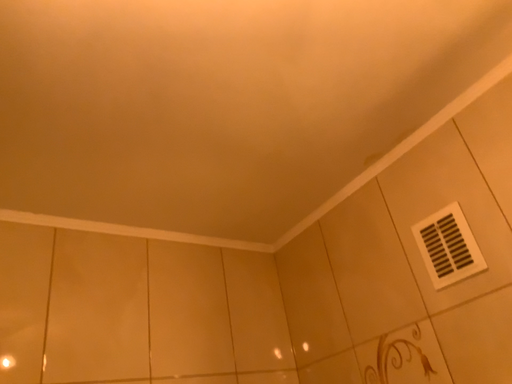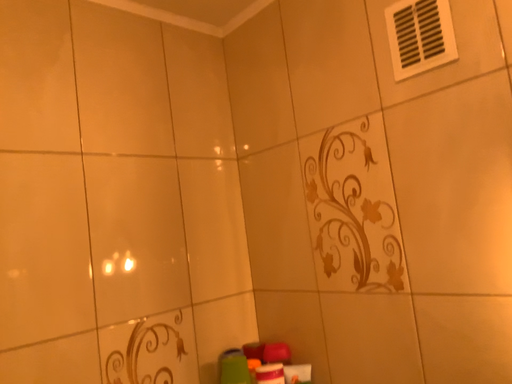
Question: How did the camera likely rotate when shooting the video?

Choices:
 (A) rotated downward
 (B) rotated upward

Answer: (A)